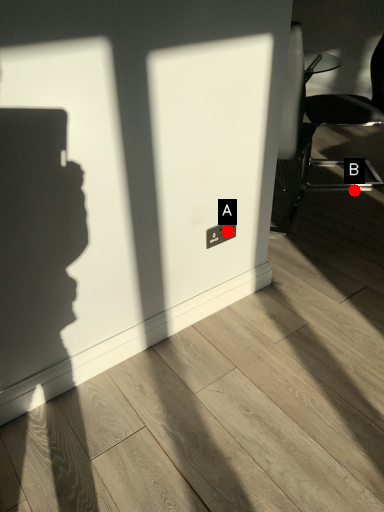
Question: Two points are circled on the image, labeled by A and B beside each circle. Which point is farther from the camera taking this photo?

Choices:
 (A) A is further
 (B) B is further

Answer: (B)